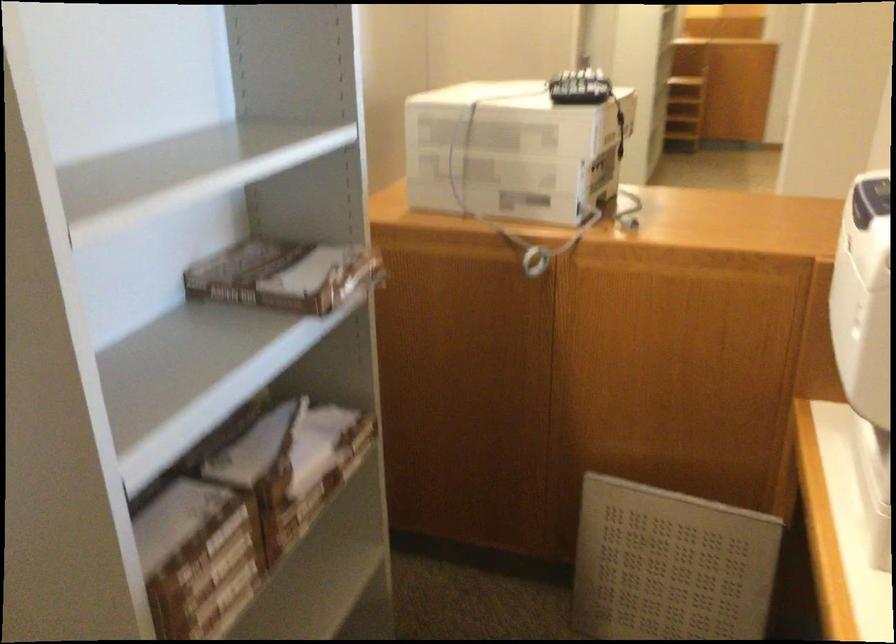
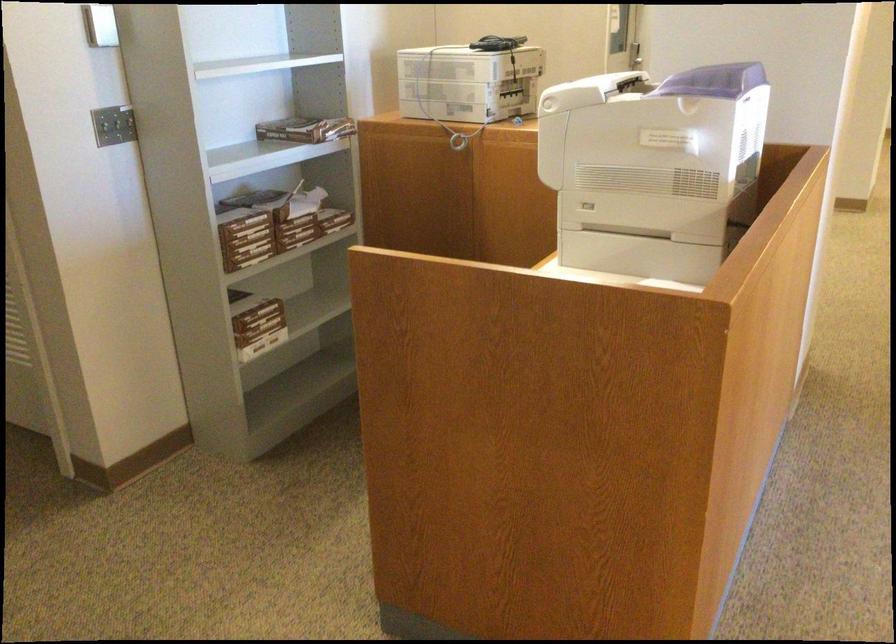
Question: I am providing you with two images of the same scene from different viewpoints. Which of the following objects are not visible in image2?

Choices:
 (A) clear light bulb
 (B) grey perforated panel
 (C) light switch
 (D) printer paper tray

Answer: (B)